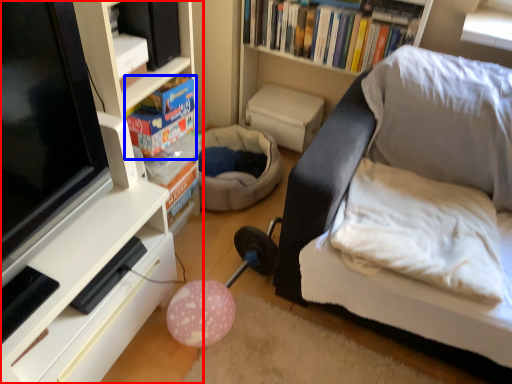
Question: Among these objects, which one is farthest to the camera, shelf (highlighted by a red box) or book (highlighted by a blue box)?

Choices:
 (A) shelf
 (B) book

Answer: (B)